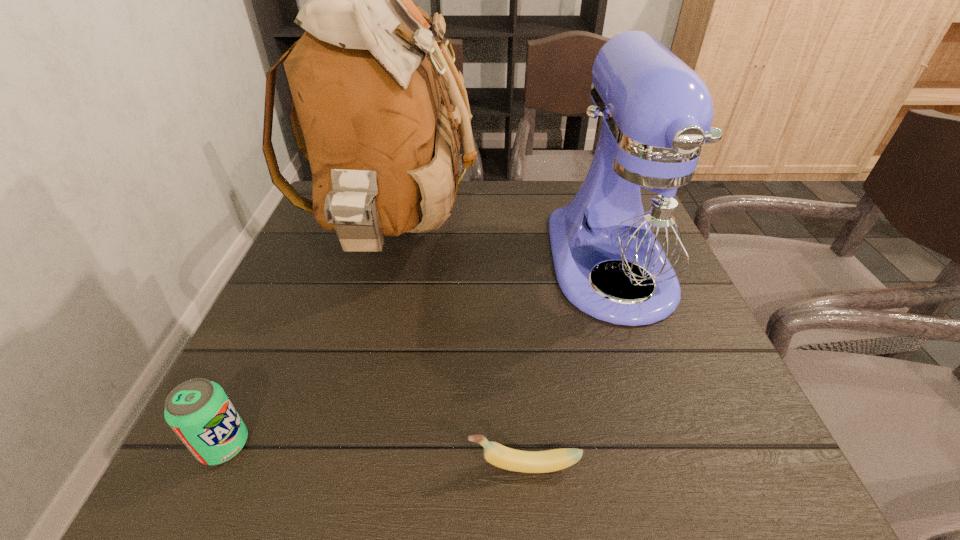
The height and width of the screenshot is (540, 960). What are the coordinates of `blank space that satisfies the following two spatial constraints: 1. at the mixing area of the mixer; 2. on the front-facing side of the pop soda` in the screenshot? It's located at (674, 445).

The image size is (960, 540). Find the location of `vacant space that satisfies the following two spatial constraints: 1. at the mixing area of the mixer; 2. at the stem of the banana`. vacant space that satisfies the following two spatial constraints: 1. at the mixing area of the mixer; 2. at the stem of the banana is located at coordinates (x=682, y=466).